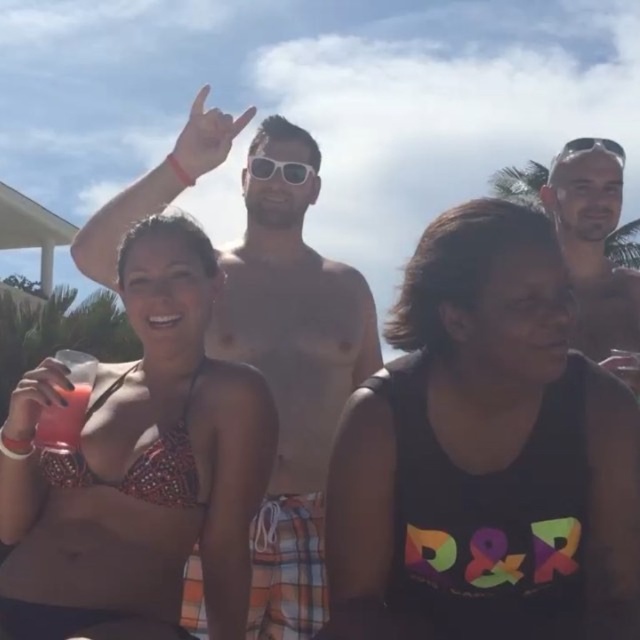
You are a photographer trying to capture a closeup of the black matte tank top at center and the shiny silver necklace at upper center. Which object should you zoom in on to ensure both are in focus without adjusting the camera settings?

The black matte tank top at center is thinner than the shiny silver necklace at upper center, so you should zoom in on the shiny silver necklace at upper center because it has a larger size and will require less magnification to capture both in focus.

You are taking a photo of the scene and want to focus on both point (595, 250) and point (58, 445). Which point should you adjust your focus to first to ensure it is in front?

Point (595, 250) is further to the camera than point (58, 445), so you should focus on point (595, 250) first since it is closer to the camera.